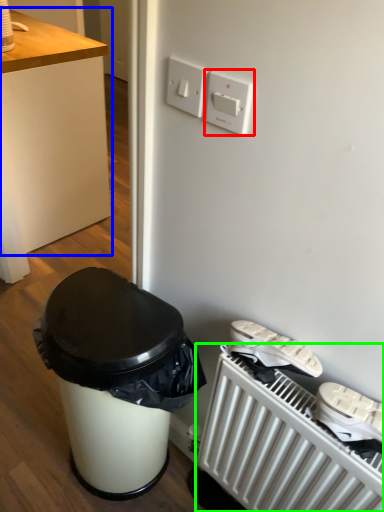
Question: Estimate the real-world distances between objects in this image. Which object is closer to light switch (highlighted by a red box), desk (highlighted by a blue box) or radiator (highlighted by a green box)?

Choices:
 (A) desk
 (B) radiator

Answer: (B)